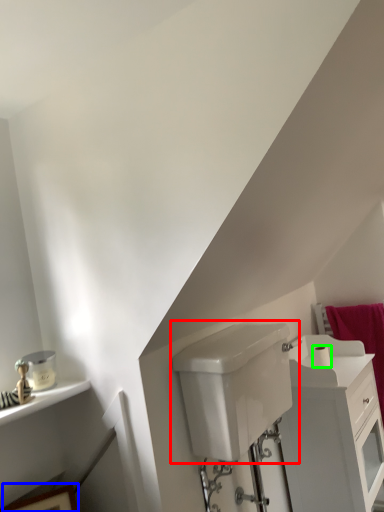
Question: Which object is positioned closest to sink (highlighted by a red box)? Select from picture frame (highlighted by a blue box) and toilet paper (highlighted by a green box).

Choices:
 (A) picture frame
 (B) toilet paper

Answer: (B)